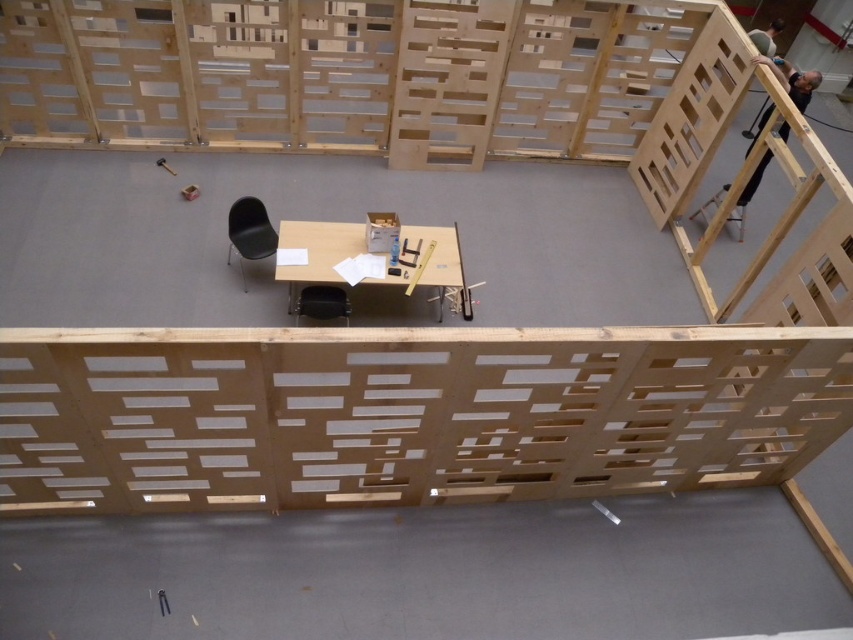
Question: Among these points, which one is farthest from the camera?

Choices:
 (A) (340, 301)
 (B) (245, 253)

Answer: (B)

Question: Does matte brown table at center appear over black plastic chair at center?

Choices:
 (A) yes
 (B) no

Answer: (A)

Question: Which of the following is the farthest from the observer?

Choices:
 (A) matte brown table at center
 (B) black matte chair at center
 (C) black plastic chair at center

Answer: (B)

Question: Is matte brown table at center below black matte chair at center?

Choices:
 (A) no
 (B) yes

Answer: (B)

Question: Does matte brown table at center have a greater width compared to black matte chair at center?

Choices:
 (A) yes
 (B) no

Answer: (A)

Question: Which of these objects is positioned farthest from the matte brown table at center?

Choices:
 (A) black matte chair at center
 (B) black plastic chair at center

Answer: (A)